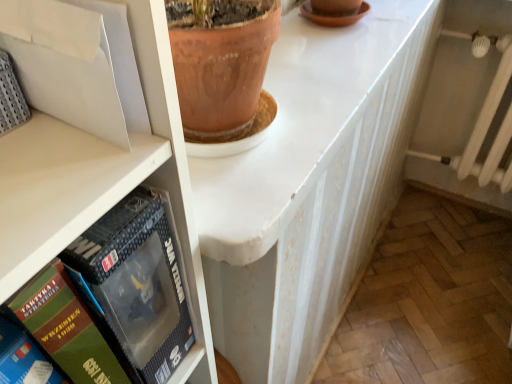
At what (x,y) coordinates should I click in order to perform the action: click on empty space that is ontop of white glossy counter top at center (from a real-world perspective). Please return your answer as a coordinate pair (x, y). The height and width of the screenshot is (384, 512). Looking at the image, I should click on (336, 60).